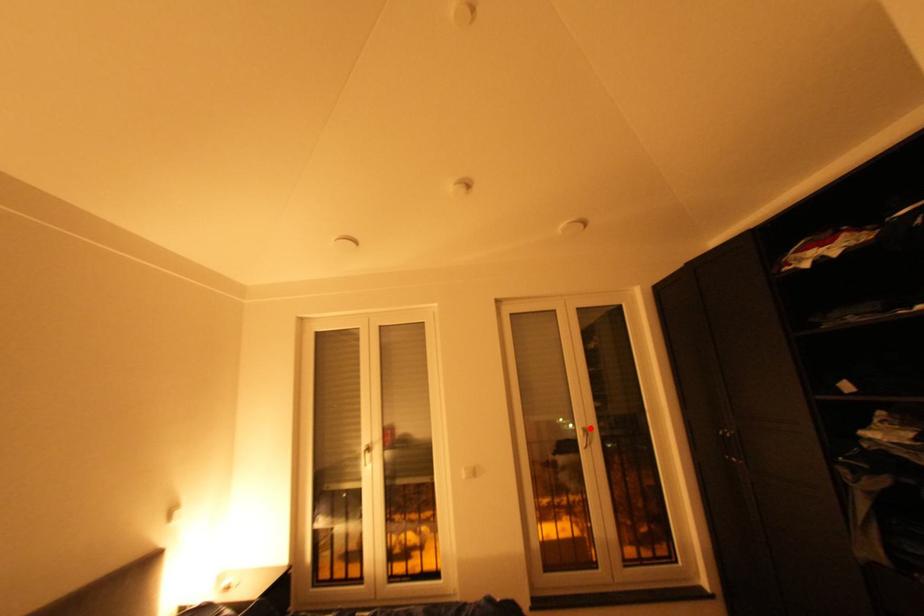
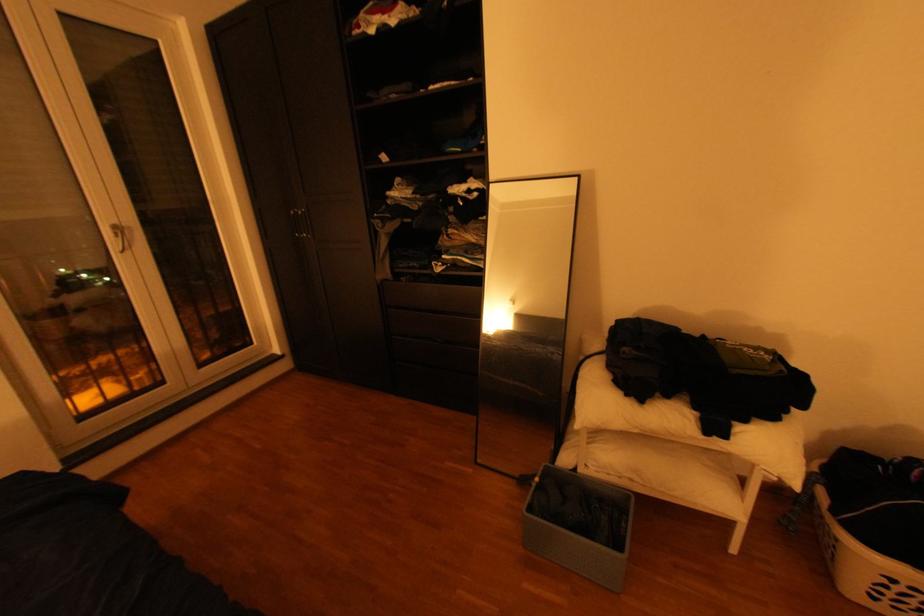
In the second image, find the point that corresponds to the highlighted location in the first image.

(117, 225)